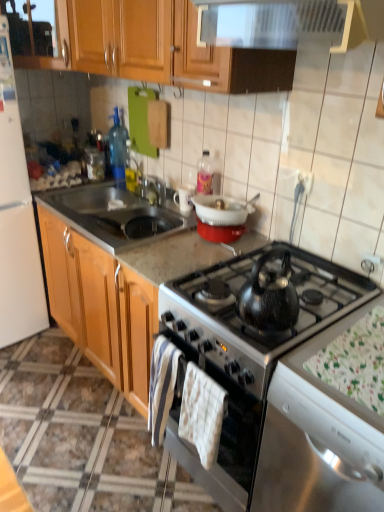
How much space does white cotton hand towel at center, which appears as the 2th hand towel when viewed from the left, occupy vertically?

The height of white cotton hand towel at center, which appears as the 2th hand towel when viewed from the left, is 13.61 inches.

What do you see at coordinates (117, 145) in the screenshot? I see `transparent plastic bottle at upper left` at bounding box center [117, 145].

Measure the distance between point (311,317) and camera.

The depth of point (311,317) is 4.34 feet.

This screenshot has height=512, width=384. What do you see at coordinates (115, 214) in the screenshot?
I see `satin silver sink at center` at bounding box center [115, 214].

This screenshot has width=384, height=512. I want to click on white cotton hand towel at center, positioned as the 1th hand towel in right-to-left order, so click(202, 414).

Is the position of white plastic bowl at upper center more distant than that of shiny metallic kettle at center-right?

Yes, it is.

Is white plastic bowl at upper center to the right of shiny metallic kettle at center-right from the viewer's perspective?

Incorrect, white plastic bowl at upper center is not on the right side of shiny metallic kettle at center-right.

Is white plastic bowl at upper center positioned beyond the bounds of shiny metallic kettle at center-right?

Yes, white plastic bowl at upper center is outside of shiny metallic kettle at center-right.

From a real-world perspective, is white plastic bowl at upper center over shiny metallic kettle at center-right?

Yes, from a real-world perspective, white plastic bowl at upper center is on top of shiny metallic kettle at center-right.

Based on the photo, from the image's perspective, which one is positioned higher, satin silver sink at center or marble gray countertop at center?

satin silver sink at center is shown above in the image.

What's the angular difference between satin silver sink at center and marble gray countertop at center's facing directions?

90.5 degrees separate the facing orientations of satin silver sink at center and marble gray countertop at center.

From a real-world perspective, is satin silver sink at center positioned under marble gray countertop at center based on gravity?

No.

Which is more to the right, satin silver sink at center or marble gray countertop at center?

From the viewer's perspective, marble gray countertop at center appears more on the right side.

Which is more to the left, white striped fabric at lower center, the 2th hand towel from the right, or white plastic bowl at upper center?

From the viewer's perspective, white striped fabric at lower center, the 2th hand towel from the right, appears more on the left side.

How different are the orientations of white striped fabric at lower center, the 2th hand towel from the right, and white plastic bowl at upper center in degrees?

The angle between the facing direction of white striped fabric at lower center, the 2th hand towel from the right, and the facing direction of white plastic bowl at upper center is 0.0015 degrees.

Is white plastic bowl at upper center located within white striped fabric at lower center, which is the first hand towel in left-to-right order?

No, white striped fabric at lower center, which is the first hand towel in left-to-right order, does not contain white plastic bowl at upper center.

From a real-world perspective, does white striped fabric at lower center, the 2th hand towel from the right, stand above white plastic bowl at upper center?

No, from a real-world perspective, white striped fabric at lower center, the 2th hand towel from the right, is not over white plastic bowl at upper center

Would you say shiny metallic kettle at center-right is a long distance from white striped fabric at lower center, which is the first hand towel in left-to-right order?

They are positioned close to each other.

Considering the positions of objects shiny metallic kettle at center-right and white striped fabric at lower center, which is the first hand towel in left-to-right order, in the image provided, who is more to the left, shiny metallic kettle at center-right or white striped fabric at lower center, which is the first hand towel in left-to-right order,?

white striped fabric at lower center, which is the first hand towel in left-to-right order.

Who is bigger, shiny metallic kettle at center-right or white striped fabric at lower center, which is the first hand towel in left-to-right order?

With larger size is shiny metallic kettle at center-right.

What's the angular difference between shiny metallic kettle at center-right and white striped fabric at lower center, the 2th hand towel from the right,'s facing directions?

The facing directions of shiny metallic kettle at center-right and white striped fabric at lower center, the 2th hand towel from the right, are 0.00184 degrees apart.

How many degrees apart are the facing directions of wooden cabinet at upper left and white striped fabric at lower center, which is the first hand towel in left-to-right order?

The angle between the facing direction of wooden cabinet at upper left and the facing direction of white striped fabric at lower center, which is the first hand towel in left-to-right order, is 46.7 degrees.

Which of these two, wooden cabinet at upper left or white striped fabric at lower center, which is the first hand towel in left-to-right order, is smaller?

With smaller size is white striped fabric at lower center, which is the first hand towel in left-to-right order.

Based on the photo, considering the relative sizes of wooden cabinet at upper left and white striped fabric at lower center, the 2th hand towel from the right, in the image provided, is wooden cabinet at upper left shorter than white striped fabric at lower center, the 2th hand towel from the right,?

Correct, wooden cabinet at upper left is not as tall as white striped fabric at lower center, the 2th hand towel from the right.

How much distance is there between white matte refrigerator at left and satin silver sink at center?

The distance of white matte refrigerator at left from satin silver sink at center is 20.12 inches.

Which object is wider, white matte refrigerator at left or satin silver sink at center?

With larger width is white matte refrigerator at left.

Which is more to the left, white matte refrigerator at left or satin silver sink at center?

From the viewer's perspective, white matte refrigerator at left appears more on the left side.

Consider the image. From the image's perspective, is white matte refrigerator at left located above or below satin silver sink at center?

Clearly, from the image's perspective, white matte refrigerator at left is above satin silver sink at center.

From a real-world perspective, between marble gray countertop at center and white cotton hand towel at center, which appears as the 2th hand towel when viewed from the left, who is vertically higher?

white cotton hand towel at center, which appears as the 2th hand towel when viewed from the left, is physically above.

In the scene shown: Can you tell me how much marble gray countertop at center and white cotton hand towel at center, which appears as the 2th hand towel when viewed from the left, differ in facing direction?

They differ by 90.5 degrees in their facing directions.

Which is in front, point (141, 277) or point (204, 442)?

The point (204, 442) is closer.

You are a GUI agent. You are given a task and a screenshot of the screen. Output one action in this format:
    pyautogui.click(x=<x>, y=<y>)
    Task: Click on the 2nd hand towel to the right of the marble gray countertop at center, starting your count from the anchor
    This screenshot has height=512, width=384.
    Given the screenshot: What is the action you would take?
    pyautogui.click(x=202, y=414)

Find the location of a particular element. silver in front of the white plastic bowl at upper center is located at coordinates (318, 439).

You are a GUI agent. You are given a task and a screenshot of the screen. Output one action in this format:
    pyautogui.click(x=<x>, y=<y>)
    Task: Click on the countertop below the satin silver sink at center (from a real-world perspective)
    
    Given the screenshot: What is the action you would take?
    pos(182,320)

Looking at the image, which one is located closer to white fabric placemat at lower right, transparent plastic bottle at upper left or satin silver sink at center?

Among the two, satin silver sink at center is located nearer to white fabric placemat at lower right.

Which object lies nearer to the anchor point white plastic bowl at upper center, white fabric placemat at lower right or satin silver sink at center?

satin silver sink at center is positioned closer to the anchor white plastic bowl at upper center.

From the image, which object appears to be farther from wooden cabinet at upper left, white plastic bowl at upper center or white matte refrigerator at left?

white plastic bowl at upper center is positioned further to the anchor wooden cabinet at upper left.

Based on their spatial positions, is metallic stainless steel exhaust hood at upper center or white matte refrigerator at left further from satin black kettle at center?

Among the two, white matte refrigerator at left is located further to satin black kettle at center.

From the image, which object appears to be nearer to white plastic bowl at upper center, white cotton hand towel at center, which appears as the 2th hand towel when viewed from the left, or wooden cabinet at upper left?

Based on the image, white cotton hand towel at center, which appears as the 2th hand towel when viewed from the left, appears to be nearer to white plastic bowl at upper center.

Which object lies nearer to the anchor point white striped fabric at lower center, which is the first hand towel in left-to-right order, shiny metallic kettle at center-right or white plastic bowl at upper center?

shiny metallic kettle at center-right is positioned closer to the anchor white striped fabric at lower center, which is the first hand towel in left-to-right order.

From the image, which object appears to be farther from satin silver sink at center, white plastic bowl at upper center or white matte refrigerator at left?

The object further to satin silver sink at center is white matte refrigerator at left.

When comparing their distances from transparent plastic bottle at upper left, does shiny metallic kettle at center-right or white striped fabric at lower center, which is the first hand towel in left-to-right order, seem further?

shiny metallic kettle at center-right lies further to transparent plastic bottle at upper left than the other object.

At what (x,y) coordinates should I click in order to perform the action: click on sink between metallic stainless steel exhaust hood at upper center and transparent plastic bottle at upper left from front to back. Please return your answer as a coordinate pair (x, y). The image size is (384, 512). Looking at the image, I should click on (115, 214).

Identify the location of kitchen appliance between white matte refrigerator at left and white fabric placemat at lower right from left to right. The height and width of the screenshot is (512, 384). (221, 210).

Find the location of a particular element. The width and height of the screenshot is (384, 512). silver between satin silver sink at center and white fabric placemat at lower right in the horizontal direction is located at coordinates (318, 439).

Image resolution: width=384 pixels, height=512 pixels. What are the coordinates of `gas stove that lies between white plastic bowl at upper center and white striped fabric at lower center, the 2th hand towel from the right, from top to bottom` in the screenshot? It's located at (263, 297).